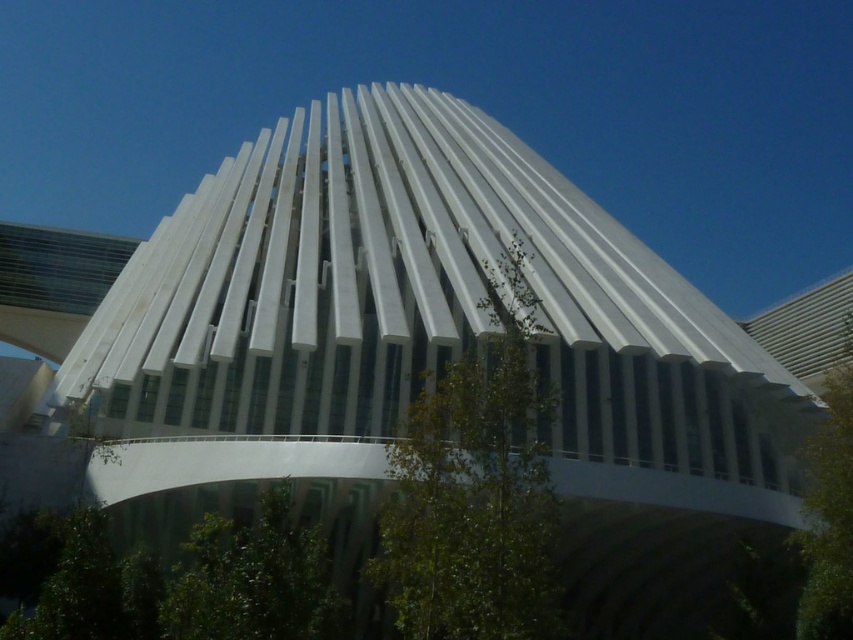
Question: Which of the following is the farthest from the observer?

Choices:
 (A) (223, 636)
 (B) (457, 508)

Answer: (A)

Question: Can you confirm if green leafy tree at lower left is smaller than green leafy tree at right?

Choices:
 (A) yes
 (B) no

Answer: (A)

Question: Which of these objects is positioned farthest from the green leafy tree at center?

Choices:
 (A) green leafy tree at lower left
 (B) green leafy tree at right

Answer: (B)

Question: Is green leafy tree at center bigger than green leafy tree at lower left?

Choices:
 (A) no
 (B) yes

Answer: (B)

Question: Which point is farther to the camera?

Choices:
 (A) green leafy tree at right
 (B) green leafy tree at center

Answer: (A)

Question: Can you confirm if green leafy tree at lower left is positioned to the left of green leafy tree at right?

Choices:
 (A) yes
 (B) no

Answer: (A)